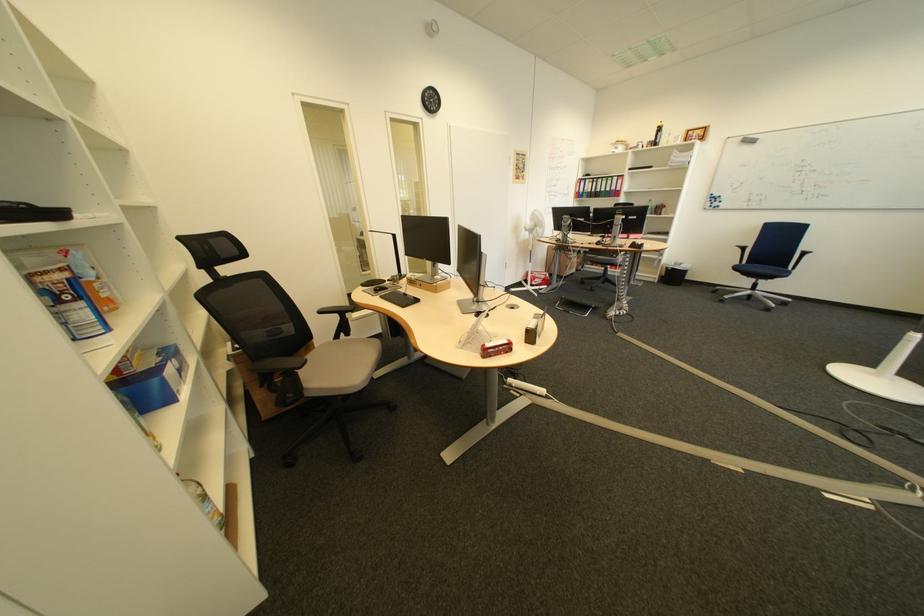
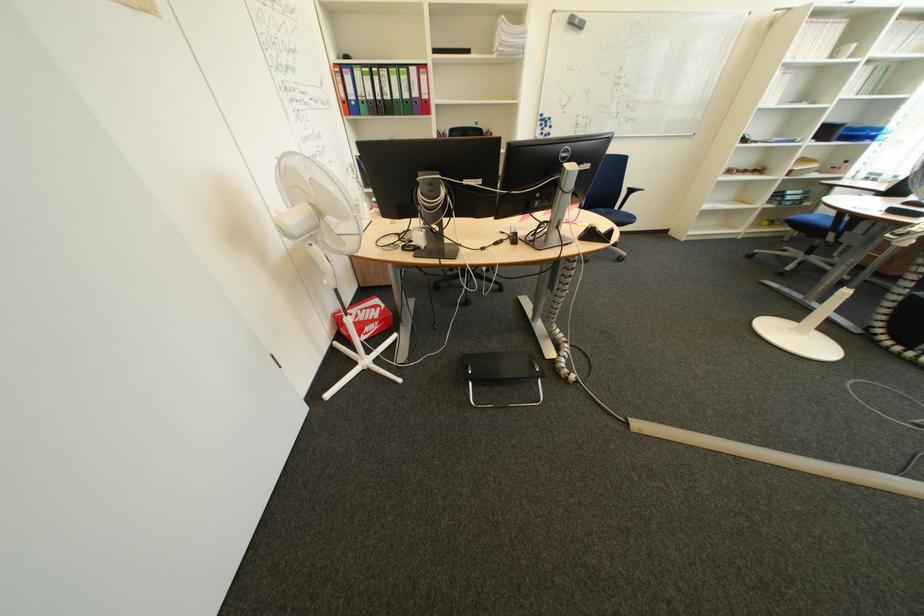
The point at (553, 281) is marked in the first image. Where is the corresponding point in the second image?

(385, 326)